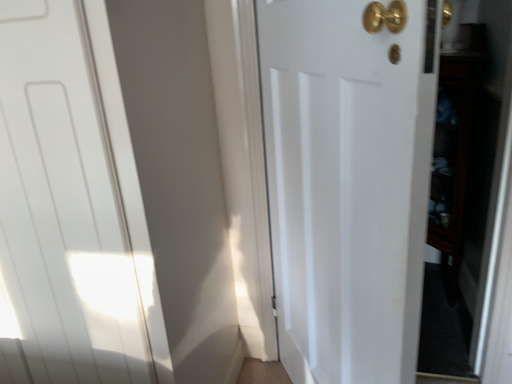
This screenshot has width=512, height=384. Find the location of `dark wood cabinet at right`. dark wood cabinet at right is located at coordinates [x=456, y=158].

Measure the distance between white matte door at left, which is the first door from left to right, and camera.

white matte door at left, which is the first door from left to right, is 86.30 centimeters away from camera.

What are the coordinates of `white matte door at center, which ranks as the 2th door in left-to-right order` in the screenshot? It's located at (348, 183).

Between dark wood cabinet at right and white matte door at center, the 1th door from the right, which one has larger width?

dark wood cabinet at right.

In the image, is dark wood cabinet at right positioned in front of or behind white matte door at center, which ranks as the 2th door in left-to-right order?

dark wood cabinet at right is behind white matte door at center, which ranks as the 2th door in left-to-right order.

From a real-world perspective, who is located higher, dark wood cabinet at right or white matte door at center, which ranks as the 2th door in left-to-right order?

white matte door at center, which ranks as the 2th door in left-to-right order.

Is dark wood cabinet at right bigger than white matte door at center, the 1th door from the right?

No.

From the picture: Is white matte door at left, which is the first door from left to right, further to camera compared to dark wood cabinet at right?

That is False.

From a real-world perspective, is white matte door at left, which appears as the 2th door when viewed from the right, positioned above or below dark wood cabinet at right?

white matte door at left, which appears as the 2th door when viewed from the right, is above dark wood cabinet at right.

Is white matte door at left, which appears as the 2th door when viewed from the right, not inside dark wood cabinet at right?

That's correct, white matte door at left, which appears as the 2th door when viewed from the right, is outside of dark wood cabinet at right.

Is point (29, 128) closer or farther from the camera than point (456, 233)?

Point (29, 128) appears to be closer to the viewer than point (456, 233).

Which object is further away from the camera, white matte door at center, the 1th door from the right, or white matte door at left, which appears as the 2th door when viewed from the right?

white matte door at left, which appears as the 2th door when viewed from the right, is more distant.

How distant is white matte door at center, which ranks as the 2th door in left-to-right order, from white matte door at left, which appears as the 2th door when viewed from the right?

They are 23.82 inches apart.

From the image's perspective, is white matte door at center, the 1th door from the right, positioned above or below white matte door at left, which is the first door from left to right?

From the image's perspective, white matte door at center, the 1th door from the right, appears below white matte door at left, which is the first door from left to right.

Can you tell me how much white matte door at center, the 1th door from the right, and white matte door at left, which is the first door from left to right, differ in facing direction?

The facing directions of white matte door at center, the 1th door from the right, and white matte door at left, which is the first door from left to right, are 120 degrees apart.

From the image's perspective, is dark wood cabinet at right below white matte door at left, which appears as the 2th door when viewed from the right?

Incorrect, from the image's perspective, dark wood cabinet at right is higher than white matte door at left, which appears as the 2th door when viewed from the right.

Is dark wood cabinet at right not close to white matte door at left, which appears as the 2th door when viewed from the right?

Absolutely, dark wood cabinet at right is distant from white matte door at left, which appears as the 2th door when viewed from the right.

How many degrees apart are the facing directions of dark wood cabinet at right and white matte door at left, which appears as the 2th door when viewed from the right?

The angle between the facing direction of dark wood cabinet at right and the facing direction of white matte door at left, which appears as the 2th door when viewed from the right, is 7.74 degrees.

How far apart are dark wood cabinet at right and white matte door at left, which appears as the 2th door when viewed from the right?

dark wood cabinet at right is 5.03 feet away from white matte door at left, which appears as the 2th door when viewed from the right.

Consider the image. From a real-world perspective, is white matte door at left, which is the first door from left to right, above or below white matte door at center, which ranks as the 2th door in left-to-right order?

From a real-world perspective, white matte door at left, which is the first door from left to right, is physically above white matte door at center, which ranks as the 2th door in left-to-right order.

Is white matte door at left, which is the first door from left to right, aimed at white matte door at center, which ranks as the 2th door in left-to-right order?

No, white matte door at left, which is the first door from left to right, does not turn towards white matte door at center, which ranks as the 2th door in left-to-right order.

Which of these two, white matte door at left, which is the first door from left to right, or white matte door at center, which ranks as the 2th door in left-to-right order, is smaller?

With smaller size is white matte door at center, which ranks as the 2th door in left-to-right order.

Is white matte door at center, the 1th door from the right, positioned far away from dark wood cabinet at right?

They are positioned close to each other.

Is white matte door at center, the 1th door from the right, not within dark wood cabinet at right?

Yes, white matte door at center, the 1th door from the right, is not within dark wood cabinet at right.

From the picture: Is white matte door at center, which ranks as the 2th door in left-to-right order, oriented away from dark wood cabinet at right?

No, dark wood cabinet at right is not at the back of white matte door at center, which ranks as the 2th door in left-to-right order.

Between white matte door at center, which ranks as the 2th door in left-to-right order, and dark wood cabinet at right, which one appears on the right side from the viewer's perspective?

From the viewer's perspective, dark wood cabinet at right appears more on the right side.

Identify the location of the 1st door to the left of the dark wood cabinet at right, counting from the anchor's position. The height and width of the screenshot is (384, 512). (348, 183).

This screenshot has height=384, width=512. Identify the location of cabinetry above the white matte door at left, which appears as the 2th door when viewed from the right (from the image's perspective). (456, 158).

From the image, which object appears to be farther from white matte door at center, the 1th door from the right, white matte door at left, which appears as the 2th door when viewed from the right, or dark wood cabinet at right?

Among the two, dark wood cabinet at right is located further to white matte door at center, the 1th door from the right.

From the image, which object appears to be farther from white matte door at left, which is the first door from left to right, white matte door at center, which ranks as the 2th door in left-to-right order, or dark wood cabinet at right?

dark wood cabinet at right is positioned further to the anchor white matte door at left, which is the first door from left to right.

Based on the photo, looking at the image, which one is located closer to dark wood cabinet at right, white matte door at center, which ranks as the 2th door in left-to-right order, or white matte door at left, which appears as the 2th door when viewed from the right?

Among the two, white matte door at center, which ranks as the 2th door in left-to-right order, is located nearer to dark wood cabinet at right.

Estimate the real-world distances between objects in this image. Which object is closer to dark wood cabinet at right, white matte door at left, which appears as the 2th door when viewed from the right, or white matte door at center, which ranks as the 2th door in left-to-right order?

Based on the image, white matte door at center, which ranks as the 2th door in left-to-right order, appears to be nearer to dark wood cabinet at right.

From the image, which object appears to be farther from white matte door at center, which ranks as the 2th door in left-to-right order, dark wood cabinet at right or white matte door at left, which appears as the 2th door when viewed from the right?

dark wood cabinet at right.

Estimate the real-world distances between objects in this image. Which object is further from white matte door at left, which is the first door from left to right, dark wood cabinet at right or white matte door at center, which ranks as the 2th door in left-to-right order?

dark wood cabinet at right lies further to white matte door at left, which is the first door from left to right, than the other object.

This screenshot has width=512, height=384. What are the coordinates of `door between white matte door at left, which is the first door from left to right, and dark wood cabinet at right from left to right` in the screenshot? It's located at 348,183.